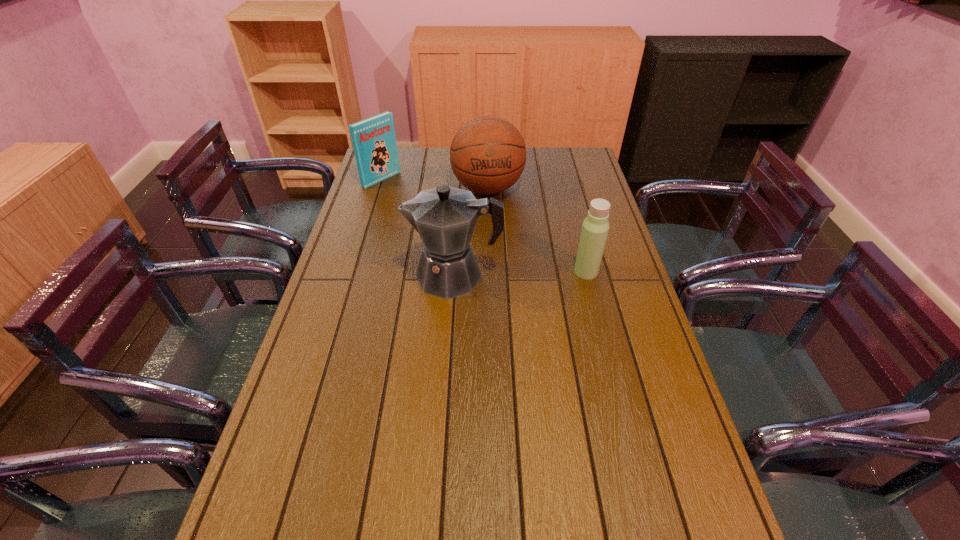
Identify the location of coffeepot. The height and width of the screenshot is (540, 960). (445, 217).

At what (x,y) coordinates should I click in order to perform the action: click on the rightmost object. Please return your answer as a coordinate pair (x, y). The height and width of the screenshot is (540, 960). Looking at the image, I should click on (595, 227).

You are a GUI agent. You are given a task and a screenshot of the screen. Output one action in this format:
    pyautogui.click(x=<x>, y=<y>)
    Task: Click on the basketball
    This screenshot has width=960, height=540.
    Given the screenshot: What is the action you would take?
    pyautogui.click(x=487, y=155)

Locate an element on the screen. book is located at coordinates (374, 142).

You are a GUI agent. You are given a task and a screenshot of the screen. Output one action in this format:
    pyautogui.click(x=<x>, y=<y>)
    Task: Click on the free spot located at the spout of the coffeepot
    The height and width of the screenshot is (540, 960).
    Given the screenshot: What is the action you would take?
    [343, 275]

Locate an element on the screen. This screenshot has width=960, height=540. free space located 0.050m at the spout of the coffeepot is located at coordinates (392, 275).

You are a GUI agent. You are given a task and a screenshot of the screen. Output one action in this format:
    pyautogui.click(x=<x>, y=<y>)
    Task: Click on the free location located 0.140m at the spout of the coffeepot
    The height and width of the screenshot is (540, 960).
    Given the screenshot: What is the action you would take?
    pyautogui.click(x=362, y=275)

You are a GUI agent. You are given a task and a screenshot of the screen. Output one action in this format:
    pyautogui.click(x=<x>, y=<y>)
    Task: Click on the vacant region located 0.230m on the front of the rightmost object
    
    Given the screenshot: What is the action you would take?
    pyautogui.click(x=603, y=340)

You are a GUI agent. You are given a task and a screenshot of the screen. Output one action in this format:
    pyautogui.click(x=<x>, y=<y>)
    Task: Click on the free location located 0.390m on the side with brand label of the basketball
    The width and height of the screenshot is (960, 540).
    Given the screenshot: What is the action you would take?
    pyautogui.click(x=504, y=285)

This screenshot has height=540, width=960. What are the coordinates of `vacant space located on the side with brand label of the basketball` in the screenshot? It's located at (505, 287).